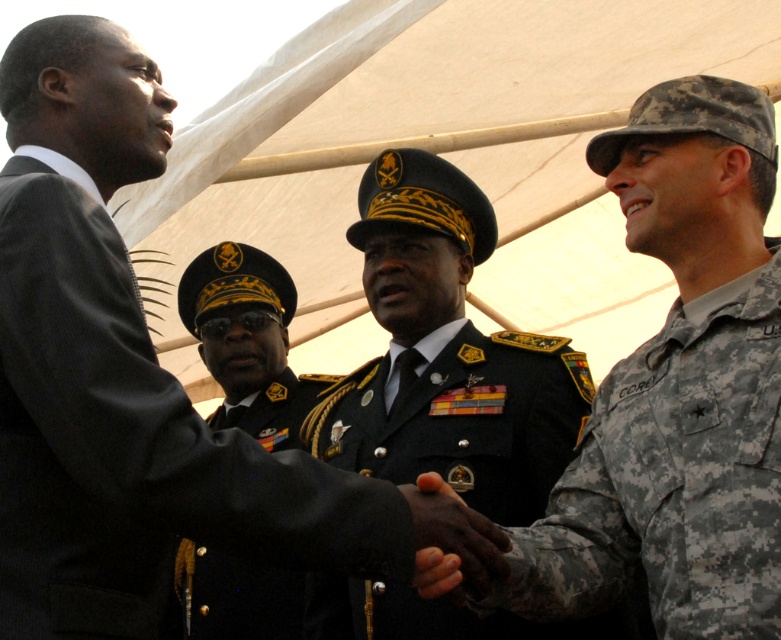
You are a photographer at a military event. You need to capture a photo where both the camouflage uniform at right and the black uniform at center are clearly visible. Based on their positions, which uniform is closer to the camera?

The camouflage uniform at right is positioned over the black uniform at center, meaning it is closer to the camera.